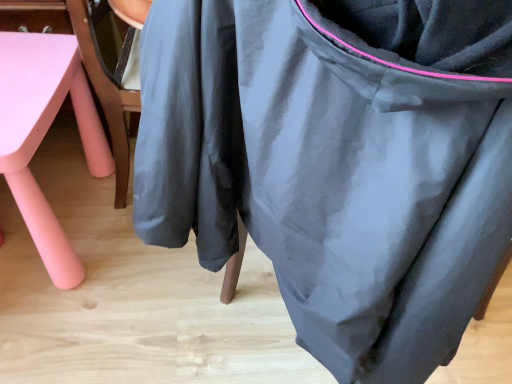
Question: Considering the relative positions of matte pink table at lower left and matte black bean bag chair at center in the image provided, is matte pink table at lower left to the left or to the right of matte black bean bag chair at center?

Choices:
 (A) right
 (B) left

Answer: (B)

Question: Which is correct: matte pink table at lower left is inside matte black bean bag chair at center, or outside of it?

Choices:
 (A) inside
 (B) outside

Answer: (B)

Question: Is matte pink table at lower left bigger or smaller than matte black bean bag chair at center?

Choices:
 (A) small
 (B) big

Answer: (A)

Question: Considering the positions of matte black bean bag chair at center and matte pink table at lower left in the image, is matte black bean bag chair at center bigger or smaller than matte pink table at lower left?

Choices:
 (A) big
 (B) small

Answer: (A)

Question: Considering the positions of matte black bean bag chair at center and matte pink table at lower left in the image, is matte black bean bag chair at center wider or thinner than matte pink table at lower left?

Choices:
 (A) wide
 (B) thin

Answer: (A)

Question: From the image's perspective, relative to matte pink table at lower left, is matte black bean bag chair at center above or below?

Choices:
 (A) below
 (B) above

Answer: (A)

Question: From a real-world perspective, is matte black bean bag chair at center physically located above or below matte pink table at lower left?

Choices:
 (A) below
 (B) above

Answer: (B)